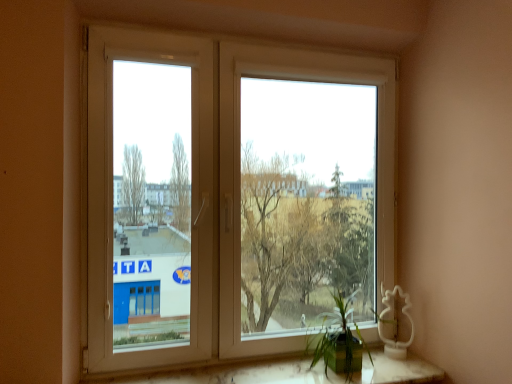
Question: Can you confirm if white marble window sill at lower center is smaller than white plastic window at center?

Choices:
 (A) no
 (B) yes

Answer: (B)

Question: Is white marble window sill at lower center positioned beyond the bounds of white plastic window at center?

Choices:
 (A) no
 (B) yes

Answer: (B)

Question: Considering the relative sizes of white marble window sill at lower center and white plastic window at center in the image provided, is white marble window sill at lower center wider than white plastic window at center?

Choices:
 (A) no
 (B) yes

Answer: (B)

Question: Is white marble window sill at lower center facing away from white plastic window at center?

Choices:
 (A) yes
 (B) no

Answer: (B)

Question: Could you tell me if white marble window sill at lower center is facing white plastic window at center?

Choices:
 (A) yes
 (B) no

Answer: (B)

Question: Is white marble window sill at lower center far from white plastic window at center?

Choices:
 (A) yes
 (B) no

Answer: (A)

Question: Is white plastic window at left wider than white plastic window at center?

Choices:
 (A) no
 (B) yes

Answer: (A)

Question: From the image's perspective, is white plastic window at left beneath white plastic window at center?

Choices:
 (A) yes
 (B) no

Answer: (B)

Question: Is the depth of white plastic window at left greater than that of white plastic window at center?

Choices:
 (A) no
 (B) yes

Answer: (A)

Question: Is white plastic window at left closer to the viewer compared to white plastic window at center?

Choices:
 (A) yes
 (B) no

Answer: (A)

Question: Considering the relative sizes of white plastic window at left and white plastic window at center in the image provided, is white plastic window at left taller than white plastic window at center?

Choices:
 (A) yes
 (B) no

Answer: (B)

Question: Is white plastic window at center a part of white plastic window at left?

Choices:
 (A) no
 (B) yes

Answer: (A)

Question: Is green matte plant at lower right outside white plastic window at center?

Choices:
 (A) yes
 (B) no

Answer: (A)